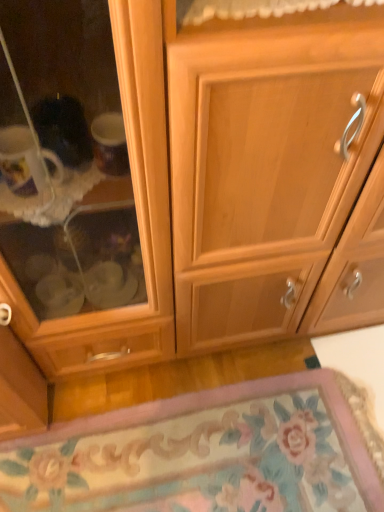
Question: Should I look upward or downward to see floral carpet at lower center?

Choices:
 (A) up
 (B) down

Answer: (B)